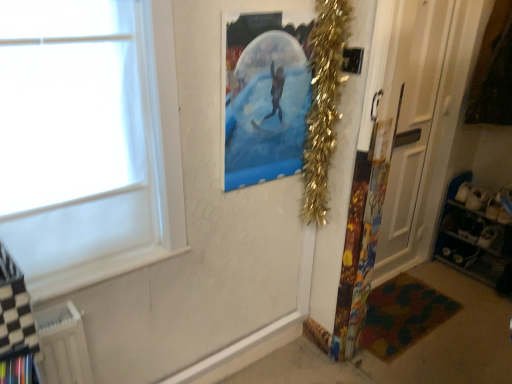
Question: From the image's perspective, is multicolored fabric mat at lower right located above white plastic radiator at lower left?

Choices:
 (A) yes
 (B) no

Answer: (B)

Question: From the image's perspective, is multicolored fabric mat at lower right located beneath white plastic radiator at lower left?

Choices:
 (A) no
 (B) yes

Answer: (B)

Question: Is multicolored fabric mat at lower right to the left of white plastic radiator at lower left from the viewer's perspective?

Choices:
 (A) no
 (B) yes

Answer: (A)

Question: Is multicolored fabric mat at lower right positioned beyond the bounds of white plastic radiator at lower left?

Choices:
 (A) yes
 (B) no

Answer: (A)

Question: Is the depth of multicolored fabric mat at lower right greater than that of white plastic radiator at lower left?

Choices:
 (A) yes
 (B) no

Answer: (A)

Question: Considering the positions of gold tinsel garland at upper right and white plastic radiator at lower left in the image, is gold tinsel garland at upper right taller or shorter than white plastic radiator at lower left?

Choices:
 (A) tall
 (B) short

Answer: (A)

Question: Would you say gold tinsel garland at upper right is to the left or to the right of white plastic radiator at lower left in the picture?

Choices:
 (A) left
 (B) right

Answer: (B)

Question: Does point (339, 16) appear closer or farther from the camera than point (65, 362)?

Choices:
 (A) farther
 (B) closer

Answer: (A)

Question: Would you say gold tinsel garland at upper right is inside or outside white plastic radiator at lower left?

Choices:
 (A) outside
 (B) inside

Answer: (A)

Question: Considering their positions, is white glossy door at right located in front of or behind multicolored fabric mat at lower right?

Choices:
 (A) behind
 (B) front

Answer: (B)

Question: Is white glossy door at right to the left or to the right of multicolored fabric mat at lower right in the image?

Choices:
 (A) left
 (B) right

Answer: (B)

Question: Is white glossy door at right situated inside multicolored fabric mat at lower right or outside?

Choices:
 (A) outside
 (B) inside

Answer: (A)

Question: Does point (437, 77) appear closer or farther from the camera than point (403, 304)?

Choices:
 (A) farther
 (B) closer

Answer: (B)

Question: From the image's perspective, is metallic blue shelves at lower right positioned above or below transparent plastic poster at upper center?

Choices:
 (A) below
 (B) above

Answer: (A)

Question: From a real-world perspective, is metallic blue shelves at lower right above or below transparent plastic poster at upper center?

Choices:
 (A) below
 (B) above

Answer: (A)